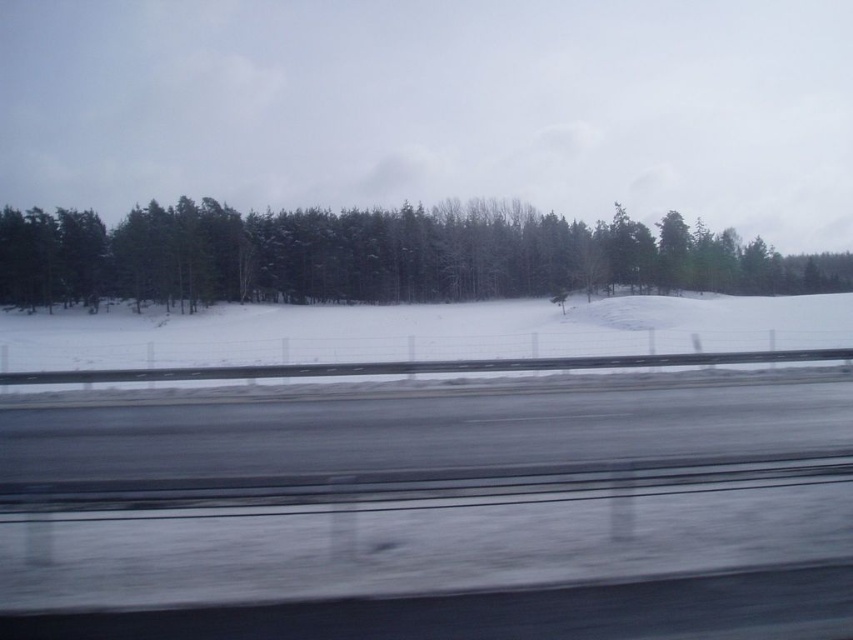
You are a photographer trying to capture the winter scene through the window of a moving car. You notice the green matte tree at left and the white powdery snow at center. Which object would appear closer to the camera based on their sizes in the image?

The green matte tree at left might be wider than white powdery snow at center, so it could appear closer to the camera since larger objects in the foreground often look bigger.

You are a passenger in a car driving along a snowy road. You notice a green matte tree at left and white powdery snow at center through the blurred window. Which object appears taller from your viewpoint?

The green matte tree at left appears taller than the white powdery snow at center because it is much taller as stated in the description.

You are driving a car and want to know if you can safely stop before hitting the green matte tree at left if you see it from the white powdery snow at center. The car is moving at 30 km per hour and has a braking distance of 20 meters. Can you stop in time?

The distance between the green matte tree at left and white powdery snow at center is 14.43 meters. Since the car requires 20 meters to stop, you cannot stop in time before hitting the green matte tree at left.